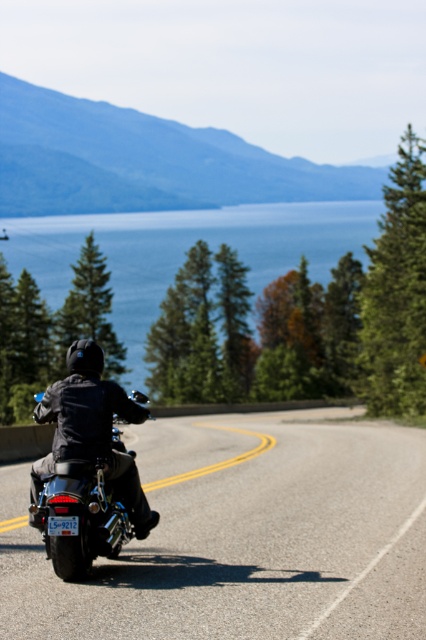
Question: Which point is closer to the camera taking this photo?

Choices:
 (A) (106, 525)
 (B) (270, 412)

Answer: (A)

Question: Considering the real-world distances, which object is closest to the shiny chrome motorcycle at center?

Choices:
 (A) black rubber motorcycle at center
 (B) blue water at center

Answer: (A)

Question: Can you confirm if blue water at center is wider than shiny chrome motorcycle at center?

Choices:
 (A) no
 (B) yes

Answer: (B)

Question: Considering the real-world distances, which object is farthest from the shiny chrome motorcycle at center?

Choices:
 (A) blue water at center
 (B) black rubber motorcycle at center

Answer: (A)

Question: Is black rubber motorcycle at center behind shiny chrome motorcycle at center?

Choices:
 (A) no
 (B) yes

Answer: (A)

Question: Does black rubber motorcycle at center appear under blue water at center?

Choices:
 (A) no
 (B) yes

Answer: (B)